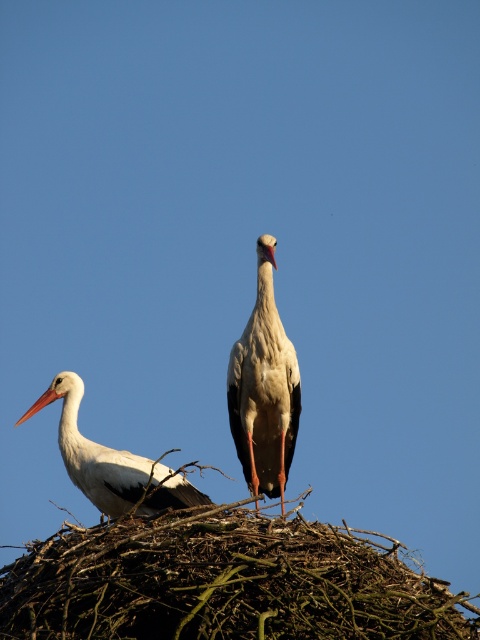
The height and width of the screenshot is (640, 480). Describe the element at coordinates (264, 387) in the screenshot. I see `white matte stork at center` at that location.

Between point (280, 483) and point (33, 403), which one is positioned in front?

Positioned in front is point (280, 483).

Locate an element on the screen. The height and width of the screenshot is (640, 480). white matte stork at center is located at coordinates (264, 387).

Is brown twigs nest at center to the right of white matte bird at left from the viewer's perspective?

Yes, brown twigs nest at center is to the right of white matte bird at left.

Between brown twigs nest at center and white matte bird at left, which one has more height?

Standing taller between the two is white matte bird at left.

You are a GUI agent. You are given a task and a screenshot of the screen. Output one action in this format:
    pyautogui.click(x=<x>, y=<y>)
    Task: Click on the brown twigs nest at center
    The height and width of the screenshot is (640, 480).
    Given the screenshot: What is the action you would take?
    pyautogui.click(x=224, y=582)

Identify the location of brown twigs nest at center. (224, 582).

Does white matte bird at left lie in front of orange matte beak at upper left?

Yes, white matte bird at left is closer to the viewer.

Which is more to the left, white matte bird at left or orange matte beak at upper left?

orange matte beak at upper left is more to the left.

Describe the element at coordinates (93, 452) in the screenshot. I see `white matte bird at left` at that location.

Find the location of `white matte bird at left`. white matte bird at left is located at coordinates (93, 452).